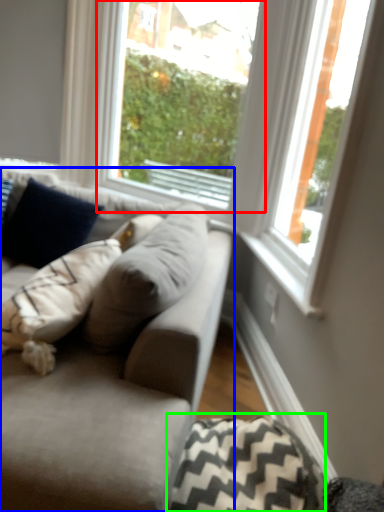
Question: Based on their relative distances, which object is farther from window (highlighted by a red box)? Choose from studio couch (highlighted by a blue box) and pillow (highlighted by a green box).

Choices:
 (A) studio couch
 (B) pillow

Answer: (B)